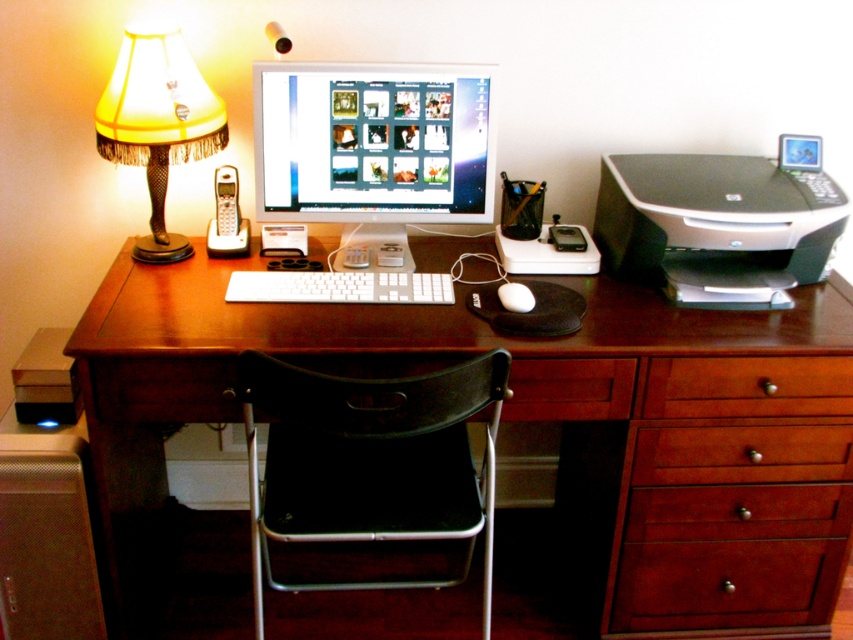
In the scene shown: You are trying to locate the silver plastic printer at right in the home office. According to the coordinates provided, where exactly is it positioned?

The silver plastic printer at right is located at point 0.355 on the x axis and 0.841 on the y axis.

You are looking at the desk in the home office. There are two points marked on the desk surface at coordinates point (x=723, y=269) and point (x=426, y=298). If you were to place a small sticker on each point, which point would appear closer to you when viewed from your current position?

Point (x=723, y=269) is further to the camera than point (x=426, y=298), so the sticker on point (x=426, y=298) would appear closer to you when viewed from your current position.

You are standing in front of the home office desk. There is a point marked at coordinates [444,465] on the desk surface. If you want to place a 1.5 meter long object horizontally on the desk, would it fit from the edge closest to you to this point?

The distance from the viewer to the point is 1.77 meters. Since the object is 1.5 meters long, placing it from the edge closest to you to the point would fit as 1.5 meters is less than 1.77 meters.